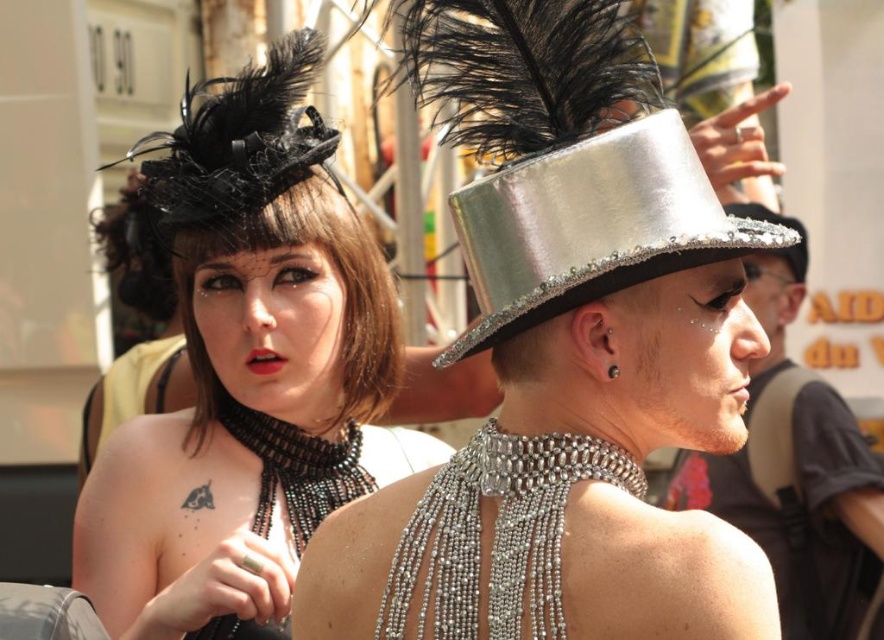
You are a photographer trying to capture the best angle of the two individuals in the image. You notice two specific points marked as point 1 at coordinates point [781,262] and point 2 at coordinates point [804,246]. Which point is closer to your camera lens?

Point [781,262] is closer to the viewer than point [804,246], so the photographer should focus on point 1 for a closer view.

You are a photographer trying to capture both the matte black hat at upper left and the silver metallic hat at center in a single frame. Which hat should you focus on first to ensure both are in focus?

You should focus on the matte black hat at upper left first because it is closer to the viewer than the silver metallic hat at center, ensuring both hats are in focus when using depth of field.